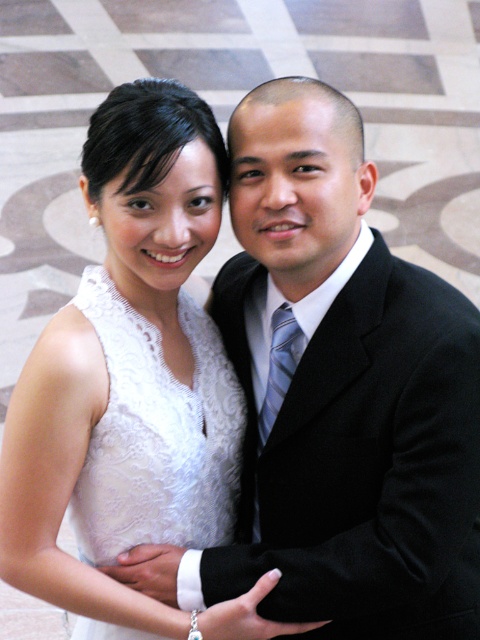
Question: Can you confirm if black satin business suit at right is thinner than white lace dress at center?

Choices:
 (A) no
 (B) yes

Answer: (A)

Question: Which point is closer to the camera?

Choices:
 (A) white lace dress at center
 (B) black satin business suit at right

Answer: (B)

Question: Is black satin business suit at right below white lace dress at center?

Choices:
 (A) yes
 (B) no

Answer: (B)

Question: Can you confirm if black satin business suit at right is bigger than white lace dress at center?

Choices:
 (A) yes
 (B) no

Answer: (A)

Question: Which point is closer to the camera?

Choices:
 (A) (91, 305)
 (B) (379, 371)

Answer: (B)